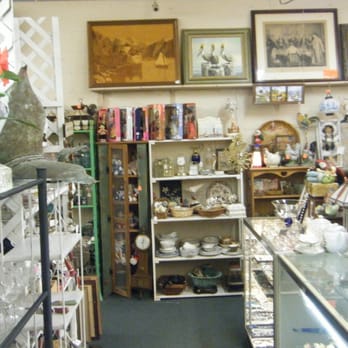
Locate an element on the screen. The width and height of the screenshot is (348, 348). shelving is located at coordinates (214, 205), (263, 198), (121, 199), (77, 213), (24, 270).